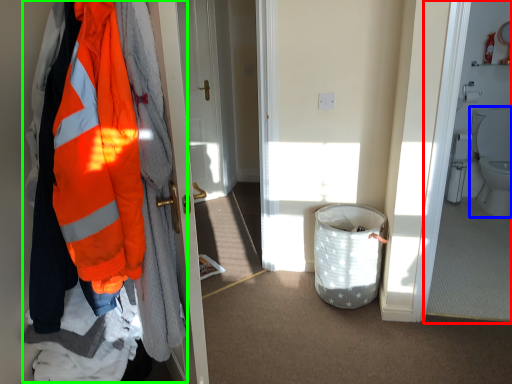
Question: Which object is positioned farthest from corridor (highlighted by a red box)? Select from toilet (highlighted by a blue box) and jacket (highlighted by a green box).

Choices:
 (A) toilet
 (B) jacket

Answer: (B)